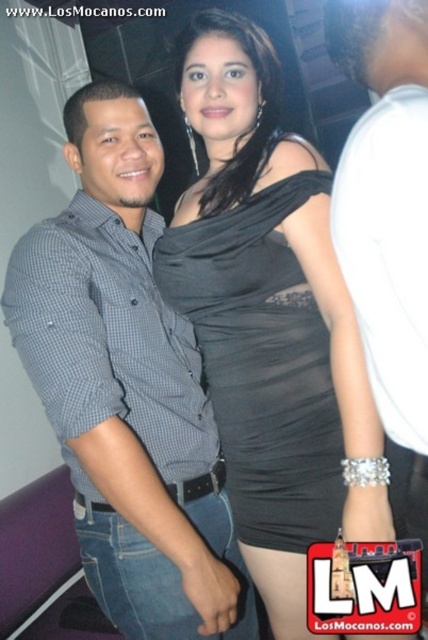
Question: Which of the following is the closest to the observer?

Choices:
 (A) (397, 109)
 (B) (124, 225)
 (C) (288, 333)

Answer: (A)

Question: Among these points, which one is farthest from the camera?

Choices:
 (A) (193, 525)
 (B) (418, 118)
 (C) (282, 275)

Answer: (A)

Question: Which point is closer to the camera?

Choices:
 (A) (196, 486)
 (B) (326, 20)

Answer: (B)

Question: Is the position of gray checkered shirt at left less distant than that of white matte shirt at center?

Choices:
 (A) no
 (B) yes

Answer: (A)

Question: Does black satin dress at center appear under white matte shirt at center?

Choices:
 (A) yes
 (B) no

Answer: (A)

Question: Is black satin dress at center positioned at the back of white matte shirt at center?

Choices:
 (A) no
 (B) yes

Answer: (B)